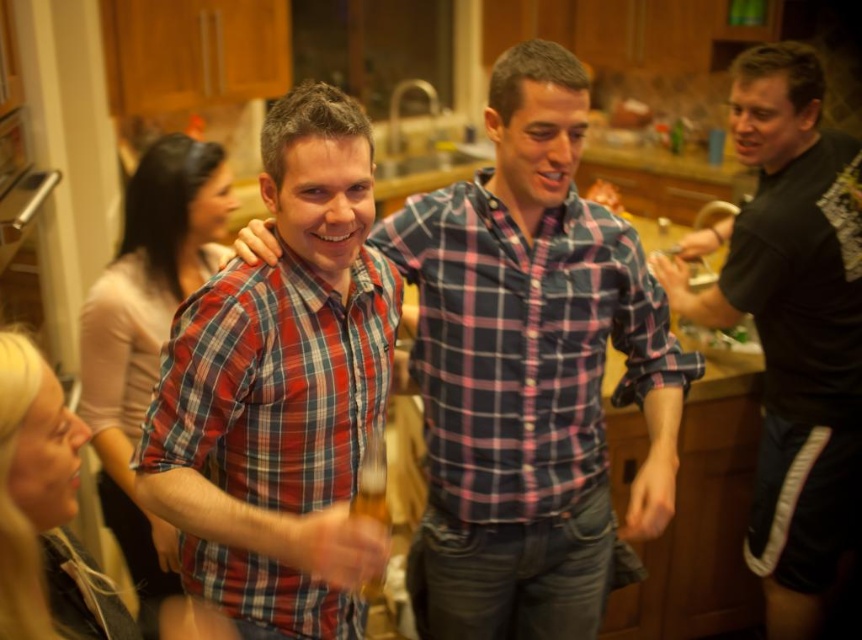
You are organizing a clothing drive and need to determine if the plaid shirt at center and the black matte shirt at right can fit into a donation box that is 40 cm wide. Based on their widths, will both shirts fit side by side?

→ The plaid shirt at center might be wider than black matte shirt at right. Since the plaid shirt at center could be wider, it might not leave enough space for the black matte shirt at right in the 40 cm donation box. It is uncertain if both will fit without overlapping.

Based on the photo, you are a photographer trying to capture a candid shot of both the plaid shirt at center and the plaid cotton shirt at center. Based on their heights, which one is more likely to be fully visible in the photo?

The plaid shirt at center is much taller than the plaid cotton shirt at center, so it is more likely to be fully visible in the photo.